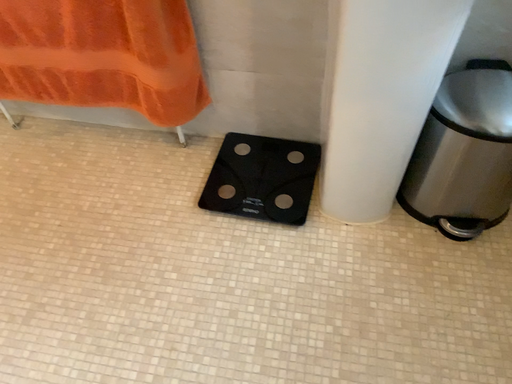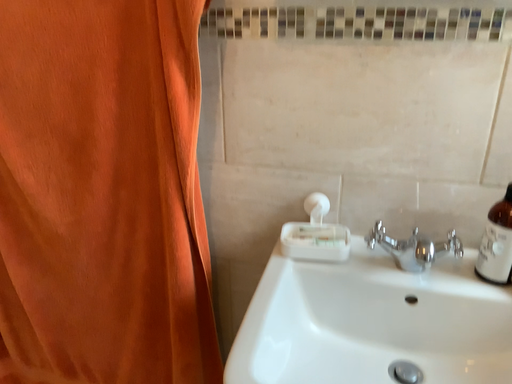
Question: Which way did the camera rotate in the video?

Choices:
 (A) rotated downward
 (B) rotated upward

Answer: (B)